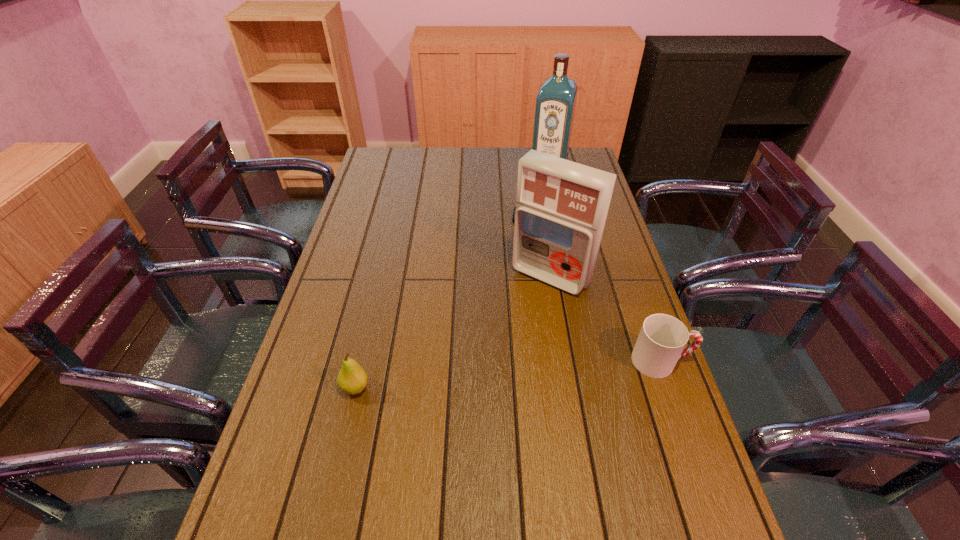
This screenshot has height=540, width=960. What are the coordinates of `the leftmost object` in the screenshot? It's located at (352, 379).

You are a GUI agent. You are given a task and a screenshot of the screen. Output one action in this format:
    pyautogui.click(x=<x>, y=<y>)
    Task: Click on the cup
    This screenshot has height=540, width=960.
    Given the screenshot: What is the action you would take?
    pyautogui.click(x=662, y=338)

Identify the location of alarm clock. (513, 217).

Locate an element on the screen. the shortest object is located at coordinates (513, 217).

This screenshot has width=960, height=540. Identify the location of liquor. (555, 104).

You are a GUI agent. You are given a task and a screenshot of the screen. Output one action in this format:
    pyautogui.click(x=<x>, y=<y>)
    Task: Click on the second tallest object
    The width and height of the screenshot is (960, 540).
    Given the screenshot: What is the action you would take?
    pyautogui.click(x=561, y=206)

The image size is (960, 540). Identify the location of the third farthest object. (561, 206).

You are a GUI agent. You are given a task and a screenshot of the screen. Output one action in this format:
    pyautogui.click(x=<x>, y=<y>)
    Task: Click on the free space located on the back of the pear
    This screenshot has height=540, width=960.
    Given the screenshot: What is the action you would take?
    pyautogui.click(x=376, y=298)

Locate an element on the screen. free location located 0.300m on the display of the shortest object is located at coordinates (523, 287).

You are a GUI agent. You are given a task and a screenshot of the screen. Output one action in this format:
    pyautogui.click(x=<x>, y=<y>)
    Task: Click on the vacant space located 0.170m on the display of the shortest object
    The height and width of the screenshot is (540, 960).
    Given the screenshot: What is the action you would take?
    pyautogui.click(x=526, y=259)